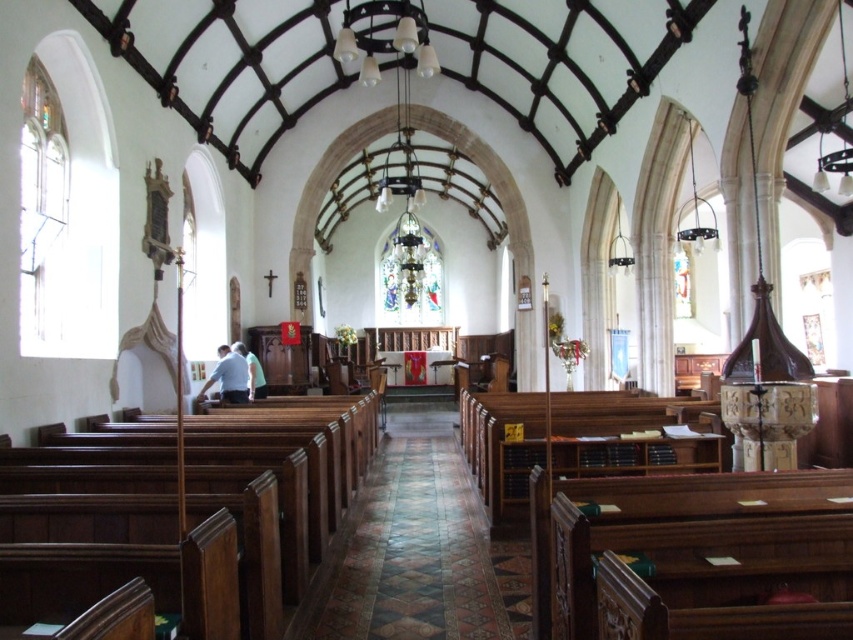
Question: Which point is closer to the camera?

Choices:
 (A) (219, 392)
 (B) (248, 355)

Answer: (A)

Question: Which object is closer to the camera taking this photo?

Choices:
 (A) carpeted wooden aisle at center
 (B) white shirt at center
 (C) light blue fabric at center

Answer: (A)

Question: Is white shirt at center to the right of light blue fabric at center from the viewer's perspective?

Choices:
 (A) yes
 (B) no

Answer: (A)

Question: Which point appears farthest from the camera in this image?

Choices:
 (A) [247, 369]
 (B) [433, 625]

Answer: (A)

Question: Can you confirm if carpeted wooden aisle at center is wider than white shirt at center?

Choices:
 (A) yes
 (B) no

Answer: (A)

Question: Is carpeted wooden aisle at center below light blue fabric at center?

Choices:
 (A) yes
 (B) no

Answer: (A)